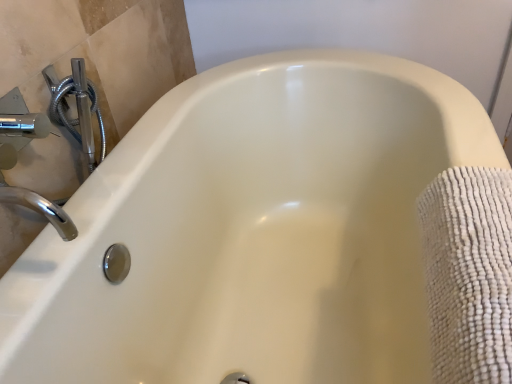
Question: Is white textured towel at right taller or shorter than chrome/metallic faucet at upper left?

Choices:
 (A) tall
 (B) short

Answer: (A)

Question: Is white textured towel at right to the left or to the right of chrome/metallic faucet at upper left in the image?

Choices:
 (A) right
 (B) left

Answer: (A)

Question: From a real-world perspective, is white textured towel at right positioned above or below chrome/metallic faucet at upper left?

Choices:
 (A) below
 (B) above

Answer: (A)

Question: In terms of width, does chrome/metallic faucet at upper left look wider or thinner when compared to white textured towel at right?

Choices:
 (A) wide
 (B) thin

Answer: (B)

Question: Would you say chrome/metallic faucet at upper left is inside or outside white textured towel at right?

Choices:
 (A) inside
 (B) outside

Answer: (B)

Question: From the image's perspective, is chrome/metallic faucet at upper left positioned above or below white textured towel at right?

Choices:
 (A) below
 (B) above

Answer: (B)

Question: In the image, is chrome/metallic faucet at upper left positioned in front of or behind white textured towel at right?

Choices:
 (A) front
 (B) behind

Answer: (B)